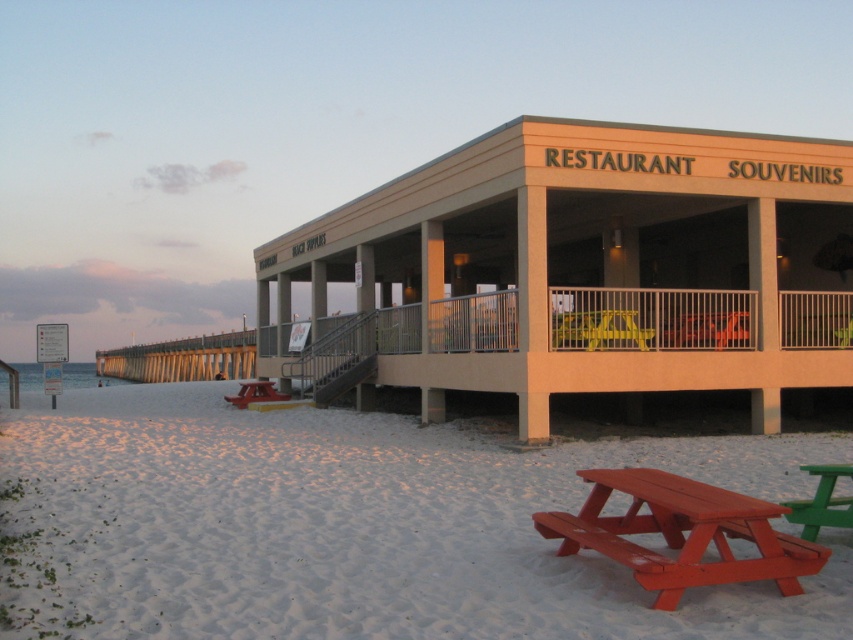
Question: Considering the real-world distances, which object is farthest from the matte red bench at lower left?

Choices:
 (A) green plastic bench at lower right
 (B) white sandy beach at lower left
 (C) red wood picnic table at lower right

Answer: (A)

Question: Which is nearer to the white sandy beach at lower left?

Choices:
 (A) green plastic bench at lower right
 (B) matte red bench at lower left

Answer: (B)

Question: Can you confirm if white sandy beach at lower left is smaller than matte red bench at lower left?

Choices:
 (A) no
 (B) yes

Answer: (A)

Question: Which point appears closest to the camera in this image?

Choices:
 (A) (322, 426)
 (B) (265, 397)

Answer: (A)

Question: Does white sandy beach at lower left appear on the right side of red wood picnic table at lower right?

Choices:
 (A) yes
 (B) no

Answer: (B)

Question: Observing the image, what is the correct spatial positioning of white sandy beach at lower left in reference to matte red bench at lower left?

Choices:
 (A) above
 (B) below

Answer: (A)